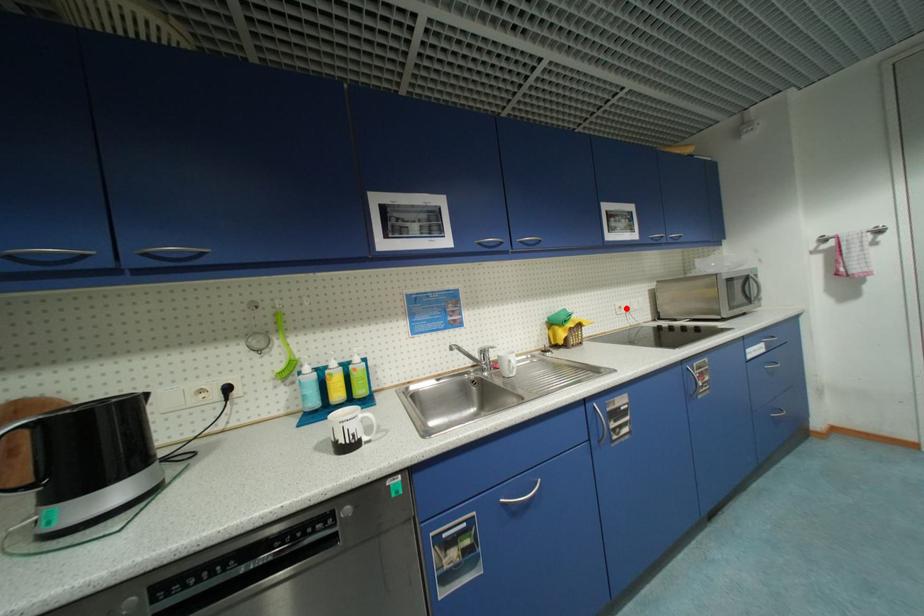
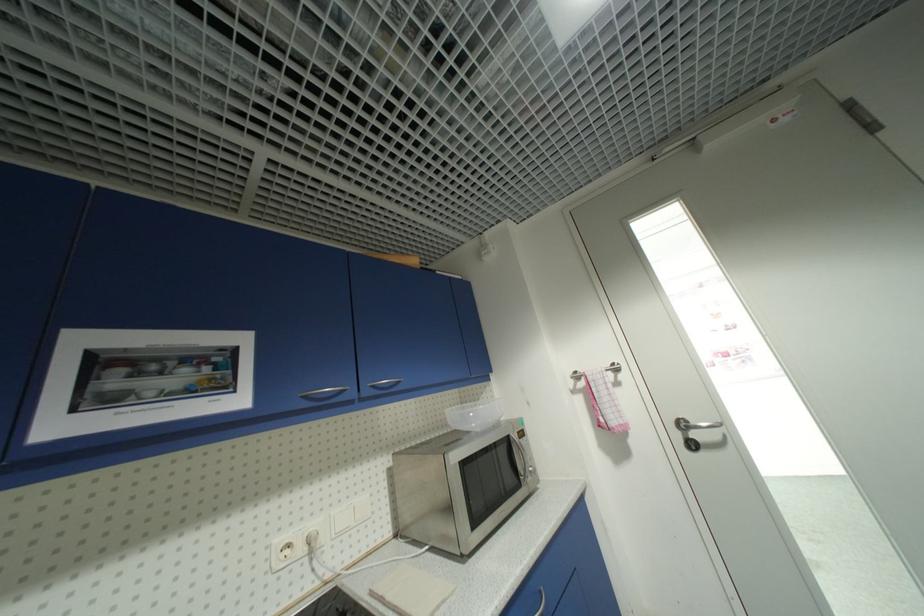
Find the pixel in the second image that matches the highlighted location in the first image.

(294, 546)